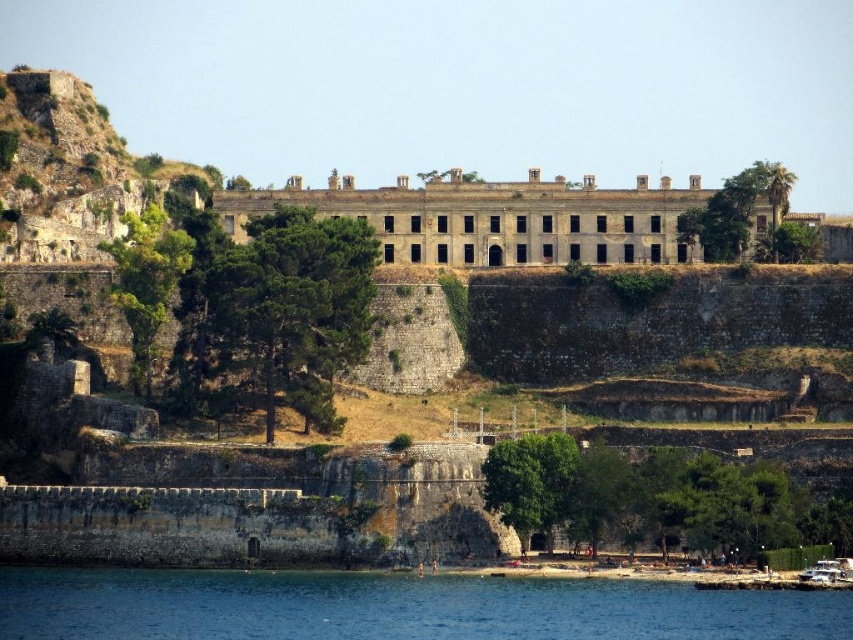
Measure the distance between clear blue water at lower left and gray stone building at center.

A distance of 58.24 meters exists between clear blue water at lower left and gray stone building at center.

Who is more distant from viewer, (509, 625) or (807, 227)?

Point (807, 227)

What are the coordinates of `clear blue water at lower left` in the screenshot? It's located at (395, 608).